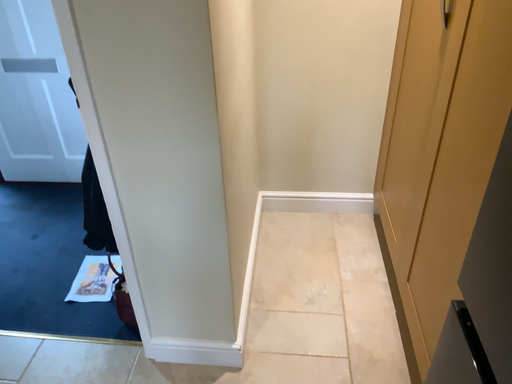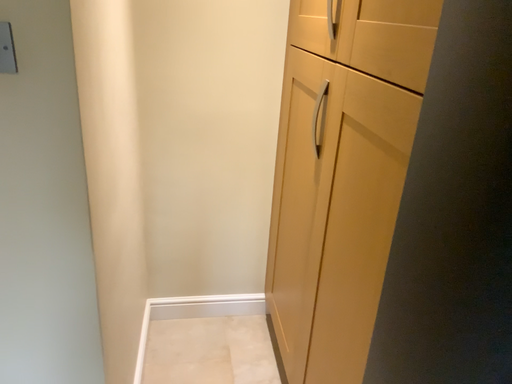
Question: How did the camera likely rotate when shooting the video?

Choices:
 (A) rotated left
 (B) rotated right

Answer: (B)